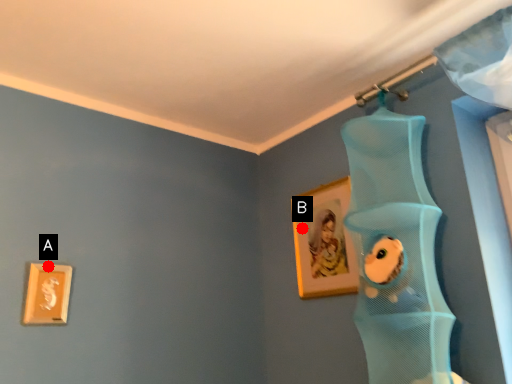
Question: Two points are circled on the image, labeled by A and B beside each circle. Which point is farther from the camera taking this photo?

Choices:
 (A) A is further
 (B) B is further

Answer: (B)